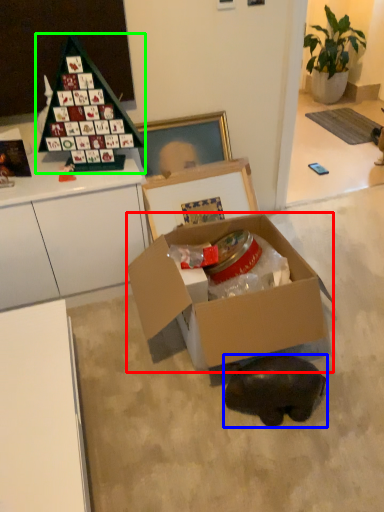
Question: Based on their relative distances, which object is nearer to box (highlighted by a red box)? Choose from animal (highlighted by a blue box) and toy (highlighted by a green box).

Choices:
 (A) animal
 (B) toy

Answer: (A)